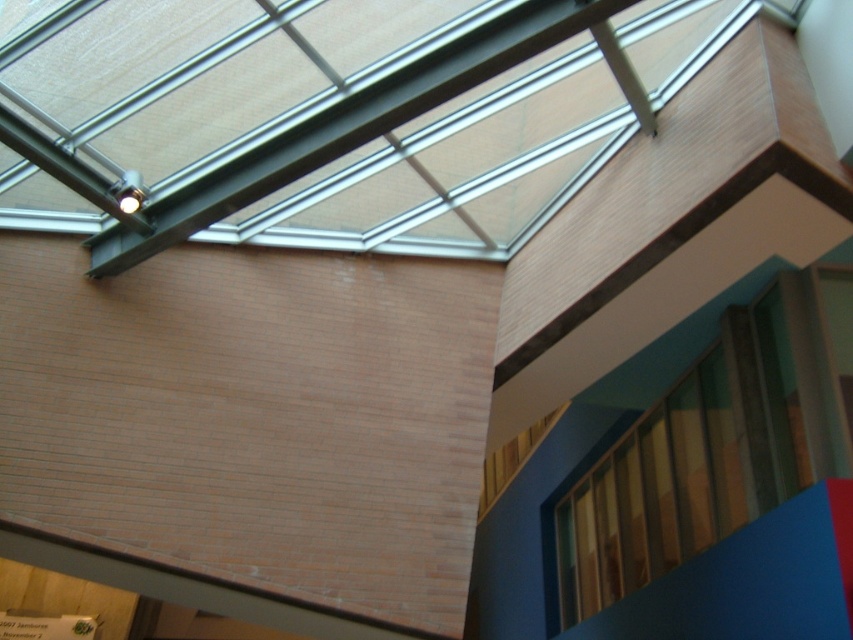
Does wooden textured window at upper right have a larger size compared to wooden at upper right?

No.

Is wooden textured window at upper right positioned behind wooden at upper right?

That is False.

Locate an element on the screen. Image resolution: width=853 pixels, height=640 pixels. wooden textured window at upper right is located at coordinates (692, 460).

At what (x,y) coordinates should I click in order to perform the action: click on wooden textured window at upper right. Please return your answer as a coordinate pair (x, y). This screenshot has height=640, width=853. Looking at the image, I should click on (692, 460).